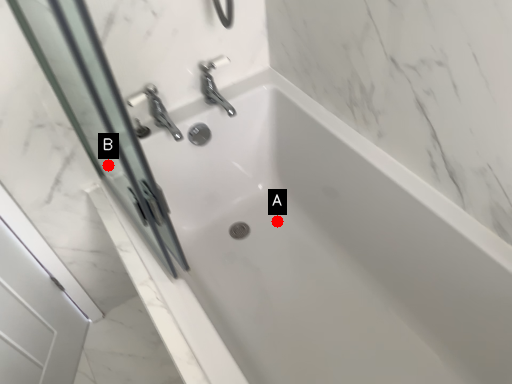
Question: Two points are circled on the image, labeled by A and B beside each circle. Among these points, which one is nearest to the camera?

Choices:
 (A) A is closer
 (B) B is closer

Answer: (B)